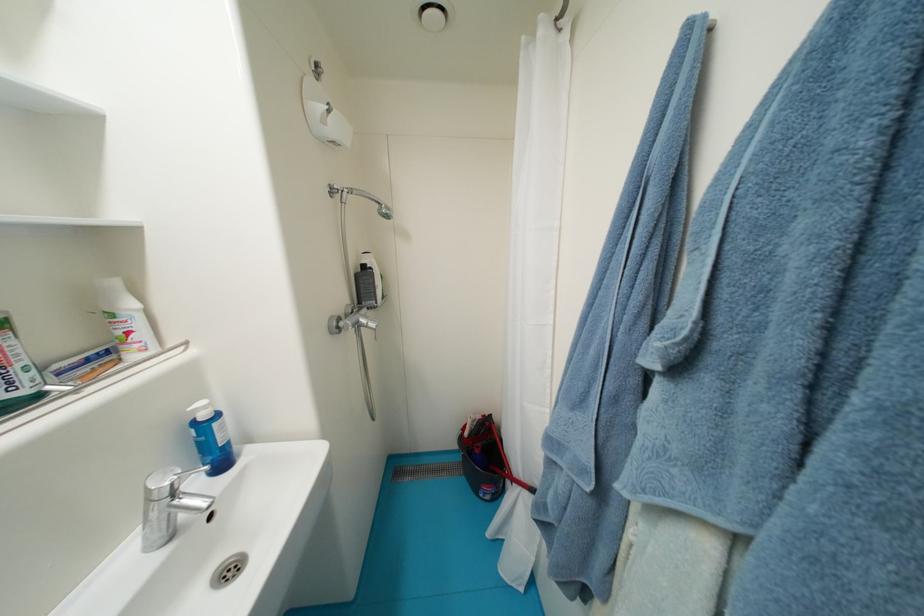
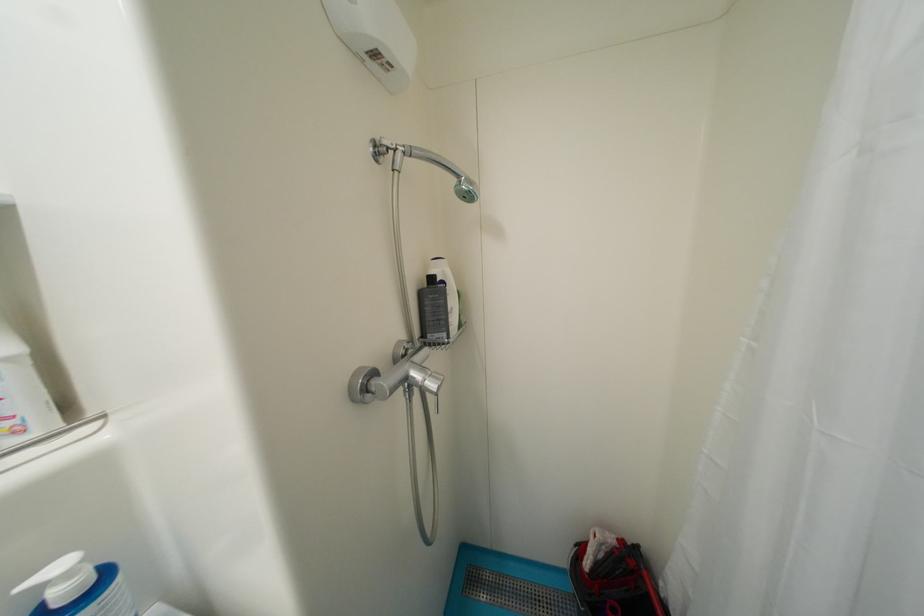
Question: Based on the continuous images, in which direction is the camera rotating? Reply with the corresponding letter.

Choices:
 (A) Left
 (B) Right
 (C) Up
 (D) Down

Answer: (A)